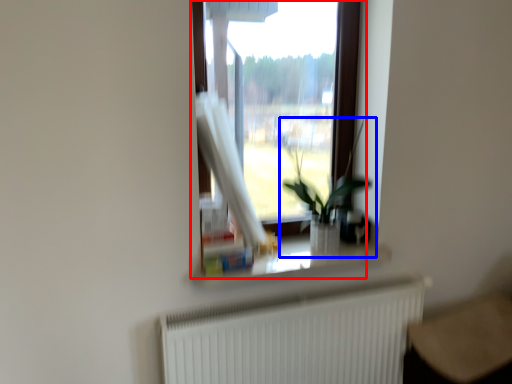
Question: Among these objects, which one is nearest to the camera, window (highlighted by a red box) or houseplant (highlighted by a blue box)?

Choices:
 (A) window
 (B) houseplant

Answer: (B)